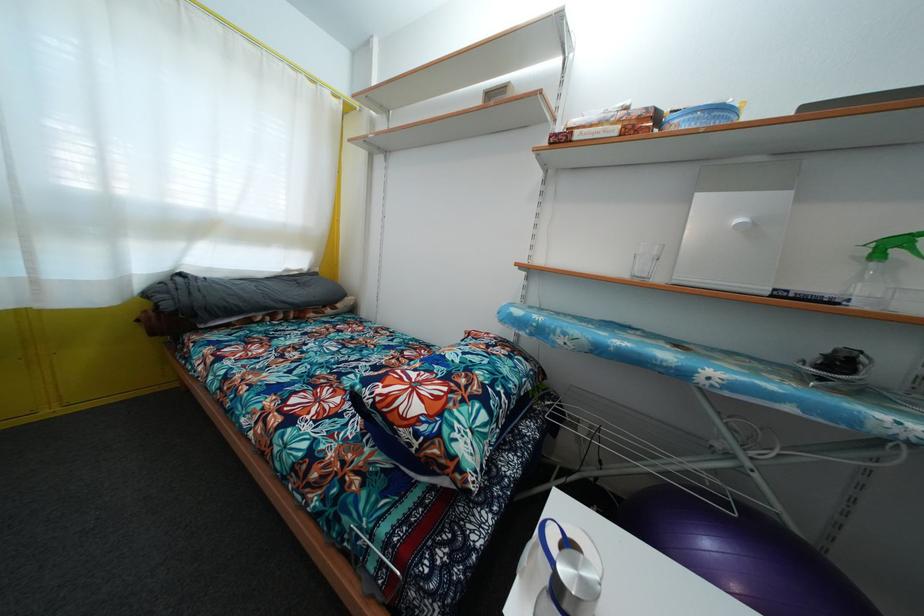
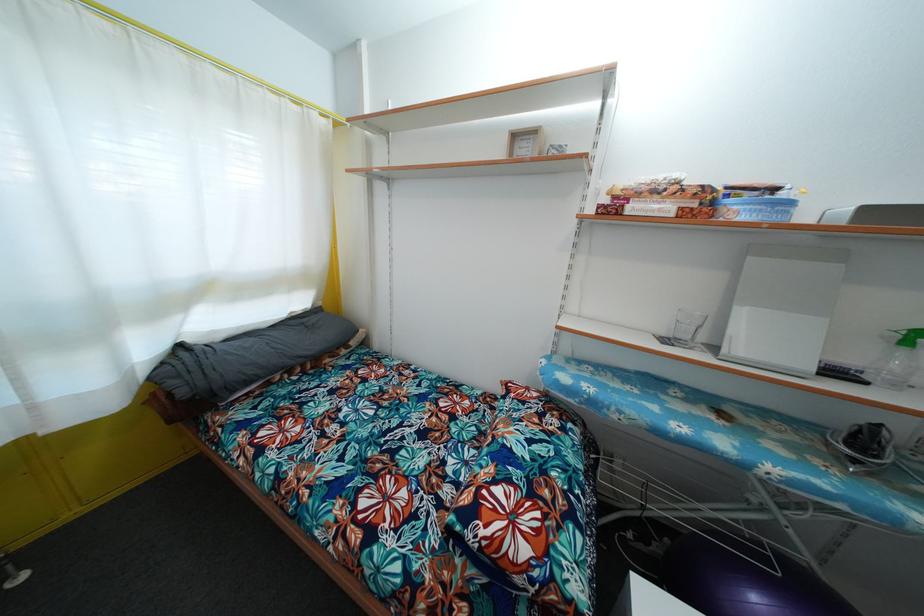
In the second image, find the point that corresponds to pixel 492 100 in the first image.

(518, 143)